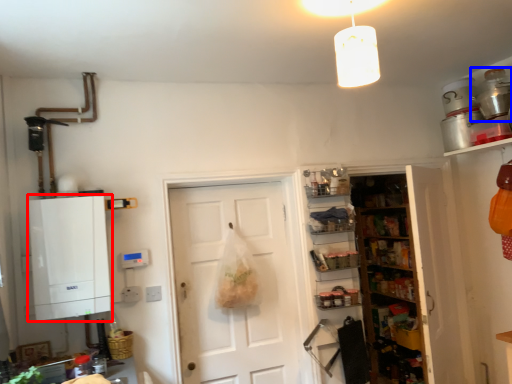
Question: Among these objects, which one is nearest to the camera, cabinetry (highlighted by a red box) or appliance (highlighted by a blue box)?

Choices:
 (A) cabinetry
 (B) appliance

Answer: (A)